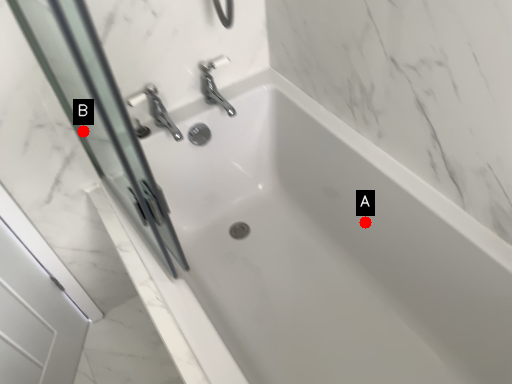
Question: Two points are circled on the image, labeled by A and B beside each circle. Which point is farther from the camera taking this photo?

Choices:
 (A) A is further
 (B) B is further

Answer: (A)